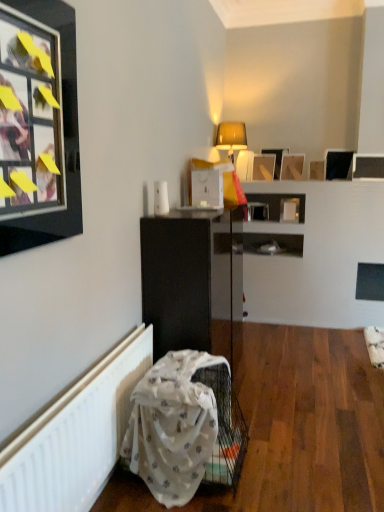
Question: Is matte black picture frame at upper right, which is the 1th picture frame from right to left, directly adjacent to wooden picture frame at upper center, which ranks as the third picture frame in left-to-right order?

Choices:
 (A) yes
 (B) no

Answer: (B)

Question: From the image's perspective, is matte black picture frame at upper right, arranged as the seventh picture frame when viewed from the left, below wooden picture frame at upper center, arranged as the 5th picture frame when viewed from the right?

Choices:
 (A) yes
 (B) no

Answer: (A)

Question: Is matte black picture frame at upper right, the 2th picture frame when ordered from front to back, not within wooden picture frame at upper center, arranged as the 5th picture frame when viewed from the right?

Choices:
 (A) no
 (B) yes

Answer: (B)

Question: Is matte black picture frame at upper right, arranged as the seventh picture frame when viewed from the left, at the right side of wooden picture frame at upper center, arranged as the 5th picture frame when viewed from the right?

Choices:
 (A) yes
 (B) no

Answer: (A)

Question: Does matte black picture frame at upper right, which appears as the 6th picture frame when viewed from the back, contain wooden picture frame at upper center, the seventh picture frame in the front-to-back sequence?

Choices:
 (A) yes
 (B) no

Answer: (B)

Question: From a real-world perspective, is matte black picture frame at upper right, the 2th picture frame when ordered from front to back, located beneath wooden picture frame at upper center, arranged as the 5th picture frame when viewed from the right?

Choices:
 (A) yes
 (B) no

Answer: (A)

Question: Is matte black picture frame at upper left, the 7th picture frame from the back, closer to the viewer compared to matte yellow table lamp at upper center?

Choices:
 (A) yes
 (B) no

Answer: (A)

Question: Can you confirm if matte black picture frame at upper left, which is counted as the first picture frame, starting from the left, is smaller than matte yellow table lamp at upper center?

Choices:
 (A) yes
 (B) no

Answer: (A)

Question: From a real-world perspective, is matte black picture frame at upper left, which is counted as the first picture frame, starting from the left, located beneath matte yellow table lamp at upper center?

Choices:
 (A) no
 (B) yes

Answer: (B)

Question: Does matte black picture frame at upper left, marked as the first picture frame in a front-to-back arrangement, touch matte yellow table lamp at upper center?

Choices:
 (A) yes
 (B) no

Answer: (B)

Question: Does matte black picture frame at upper left, which is counted as the seventh picture frame, starting from the right, come behind matte yellow table lamp at upper center?

Choices:
 (A) no
 (B) yes

Answer: (A)

Question: Would you consider matte black picture frame at upper left, which is counted as the first picture frame, starting from the left, to be distant from matte yellow table lamp at upper center?

Choices:
 (A) no
 (B) yes

Answer: (B)

Question: Is wooden picture frame at upper center, the sixth picture frame when ordered from front to back, next to black glossy picture frame at upper right, arranged as the second picture frame when viewed from the right, and touching it?

Choices:
 (A) no
 (B) yes

Answer: (A)